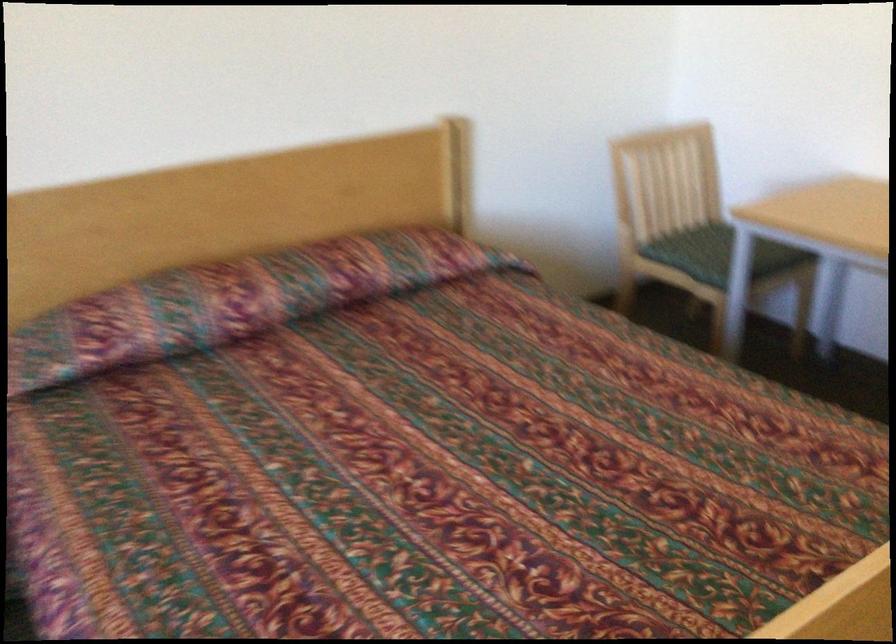
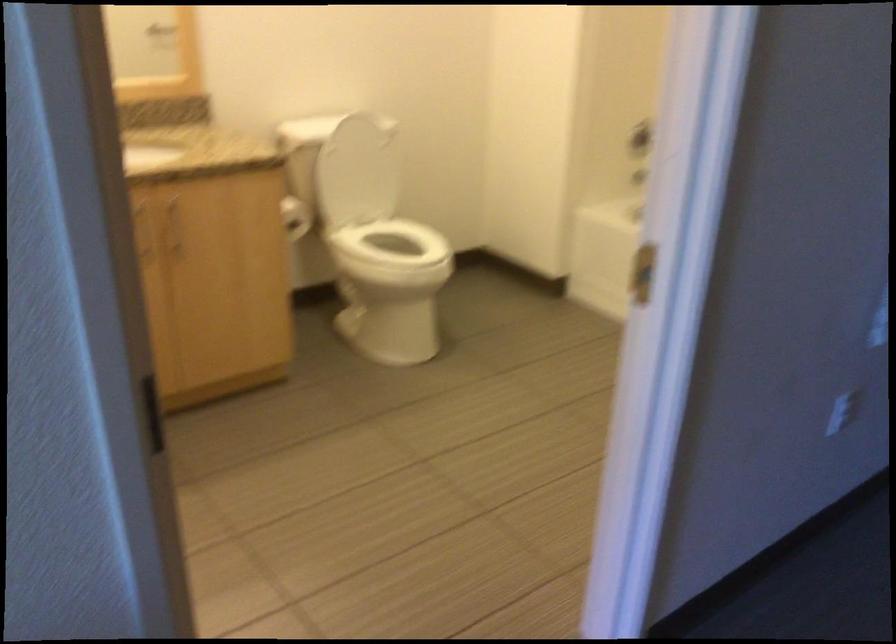
Based on the photo, which direction would the cameraman need to move to produce the second image?

The movement direction of the cameraman is right, forward.